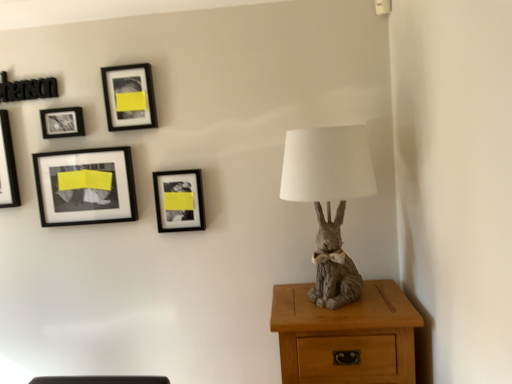
Question: Can you confirm if matte black picture frame at upper left, placed as the 2th picture frame when sorted from left to right, is positioned to the right of black glossy picture frame at upper left, the fifth picture frame positioned from the right?

Choices:
 (A) no
 (B) yes

Answer: (B)

Question: From a real-world perspective, is matte black picture frame at upper left, placed as the 2th picture frame when sorted from left to right, located higher than black glossy picture frame at upper left, the fifth picture frame positioned from the right?

Choices:
 (A) no
 (B) yes

Answer: (B)

Question: Is matte black picture frame at upper left, which ranks as the 4th picture frame in right-to-left order, closer to camera compared to black glossy picture frame at upper left, the fifth picture frame positioned from the right?

Choices:
 (A) no
 (B) yes

Answer: (B)

Question: From the image's perspective, is matte black picture frame at upper left, placed as the 2th picture frame when sorted from left to right, above black glossy picture frame at upper left, the fifth picture frame positioned from the right?

Choices:
 (A) yes
 (B) no

Answer: (A)

Question: From a real-world perspective, is matte black picture frame at upper left, which ranks as the 4th picture frame in right-to-left order, located beneath black glossy picture frame at upper left, which is counted as the first picture frame, starting from the left?

Choices:
 (A) no
 (B) yes

Answer: (A)

Question: Relative to matte black picture frame at upper left, placed as the 2th picture frame when sorted from left to right, is black matte picture frame at upper center, the 2th picture frame in the right-to-left sequence, in front or behind?

Choices:
 (A) behind
 (B) front

Answer: (B)

Question: Considering the positions of black matte picture frame at upper center, the fourth picture frame viewed from the left, and matte black picture frame at upper left, placed as the 2th picture frame when sorted from left to right, in the image, is black matte picture frame at upper center, the fourth picture frame viewed from the left, wider or thinner than matte black picture frame at upper left, placed as the 2th picture frame when sorted from left to right,?

Choices:
 (A) wide
 (B) thin

Answer: (B)

Question: From the image's perspective, is black matte picture frame at upper center, the fourth picture frame viewed from the left, above or below matte black picture frame at upper left, placed as the 2th picture frame when sorted from left to right?

Choices:
 (A) above
 (B) below

Answer: (A)

Question: Considering the positions of black matte picture frame at upper center, the 2th picture frame in the right-to-left sequence, and matte black picture frame at upper left, which ranks as the 4th picture frame in right-to-left order, in the image, is black matte picture frame at upper center, the 2th picture frame in the right-to-left sequence, bigger or smaller than matte black picture frame at upper left, which ranks as the 4th picture frame in right-to-left order,?

Choices:
 (A) big
 (B) small

Answer: (A)

Question: From the image's perspective, is gray matte rabbit at right positioned above or below matte black picture frame at upper left, placed as the 2th picture frame when sorted from left to right?

Choices:
 (A) below
 (B) above

Answer: (A)

Question: Considering the positions of gray matte rabbit at right and matte black picture frame at upper left, which ranks as the 4th picture frame in right-to-left order, in the image, is gray matte rabbit at right taller or shorter than matte black picture frame at upper left, which ranks as the 4th picture frame in right-to-left order,?

Choices:
 (A) short
 (B) tall

Answer: (B)

Question: Considering the positions of gray matte rabbit at right and matte black picture frame at upper left, placed as the 2th picture frame when sorted from left to right, in the image, is gray matte rabbit at right bigger or smaller than matte black picture frame at upper left, placed as the 2th picture frame when sorted from left to right,?

Choices:
 (A) big
 (B) small

Answer: (A)

Question: Is gray matte rabbit at right to the left or to the right of matte black picture frame at upper left, which ranks as the 4th picture frame in right-to-left order, in the image?

Choices:
 (A) left
 (B) right

Answer: (B)

Question: Considering the positions of light brown wood nightstand at lower right and gray matte rabbit at right in the image, is light brown wood nightstand at lower right taller or shorter than gray matte rabbit at right?

Choices:
 (A) short
 (B) tall

Answer: (A)

Question: Is light brown wood nightstand at lower right inside the boundaries of gray matte rabbit at right, or outside?

Choices:
 (A) inside
 (B) outside

Answer: (B)